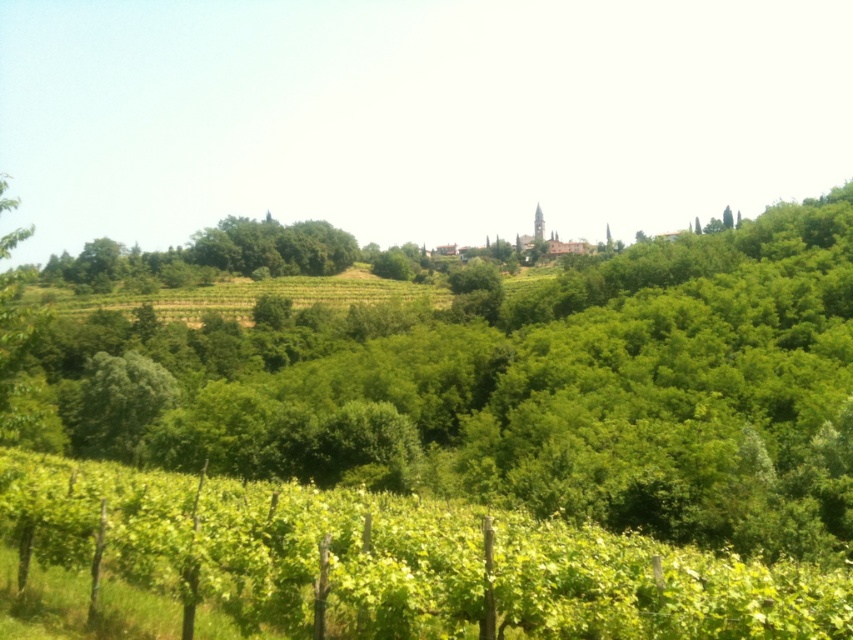
Question: Which object is closer to the camera taking this photo?

Choices:
 (A) green leafy tree at center
 (B) green leafy vineyard at lower center

Answer: (B)

Question: Among these points, which one is farthest from the camera?

Choices:
 (A) (503, 552)
 (B) (763, 323)

Answer: (B)

Question: Is green leafy tree at center thinner than green leafy vineyard at lower center?

Choices:
 (A) yes
 (B) no

Answer: (B)

Question: Considering the relative positions of green leafy tree at center and green leafy vineyard at lower center in the image provided, where is green leafy tree at center located with respect to green leafy vineyard at lower center?

Choices:
 (A) right
 (B) left

Answer: (B)

Question: Can you confirm if green leafy tree at center is positioned to the left of green leafy vineyard at lower center?

Choices:
 (A) yes
 (B) no

Answer: (A)